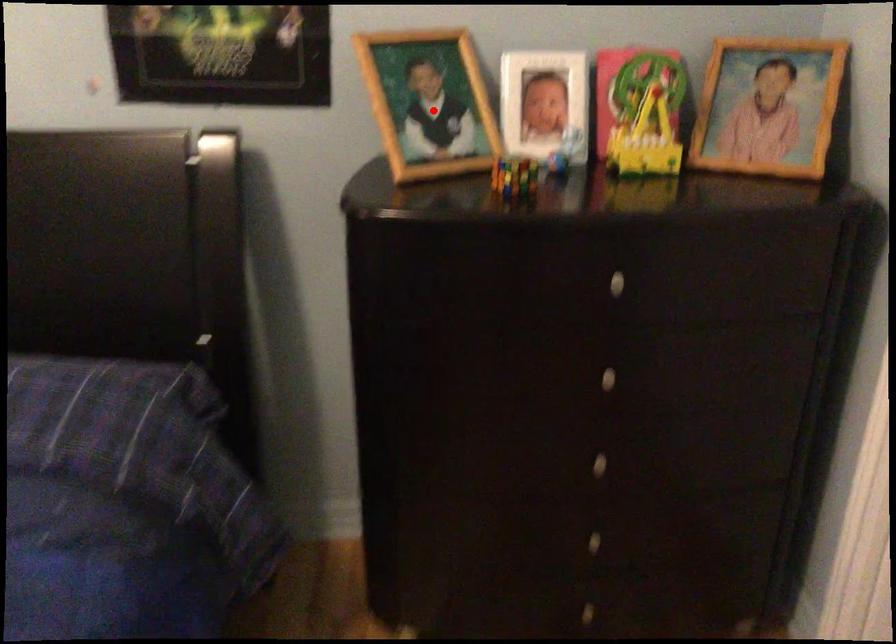
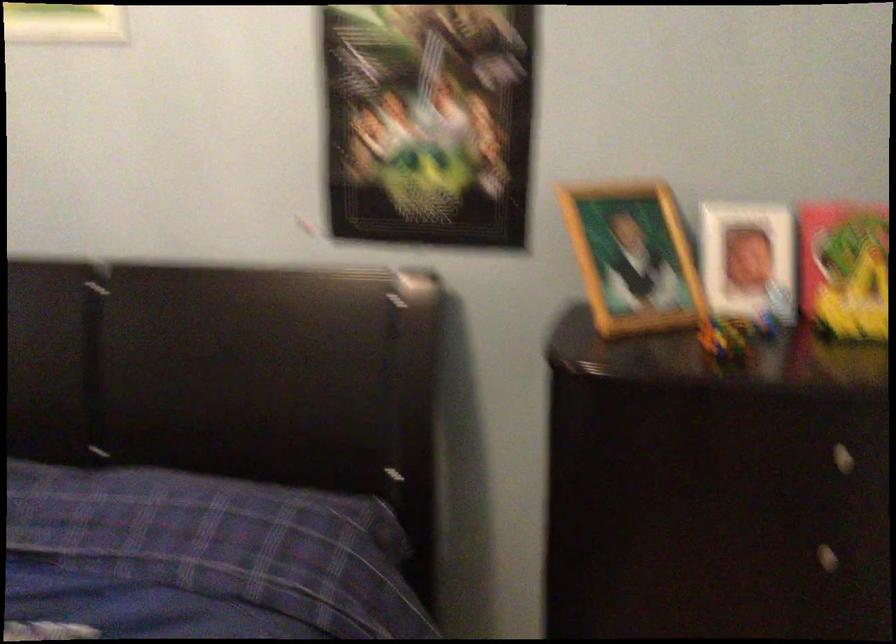
Locate, in the second image, the point that corresponds to the highlighted location in the first image.

(633, 258)